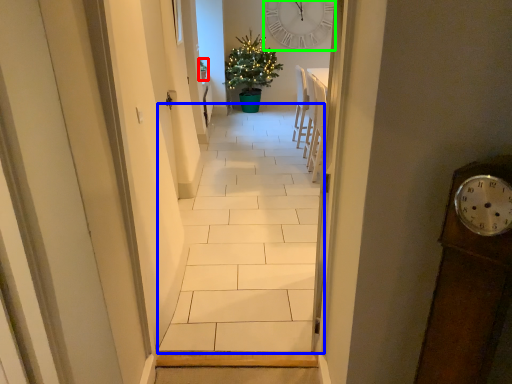
Question: Which object is positioned closest to houseplant (highlighted by a red box)? Select from path (highlighted by a blue box) and clock (highlighted by a green box).

Choices:
 (A) path
 (B) clock

Answer: (B)